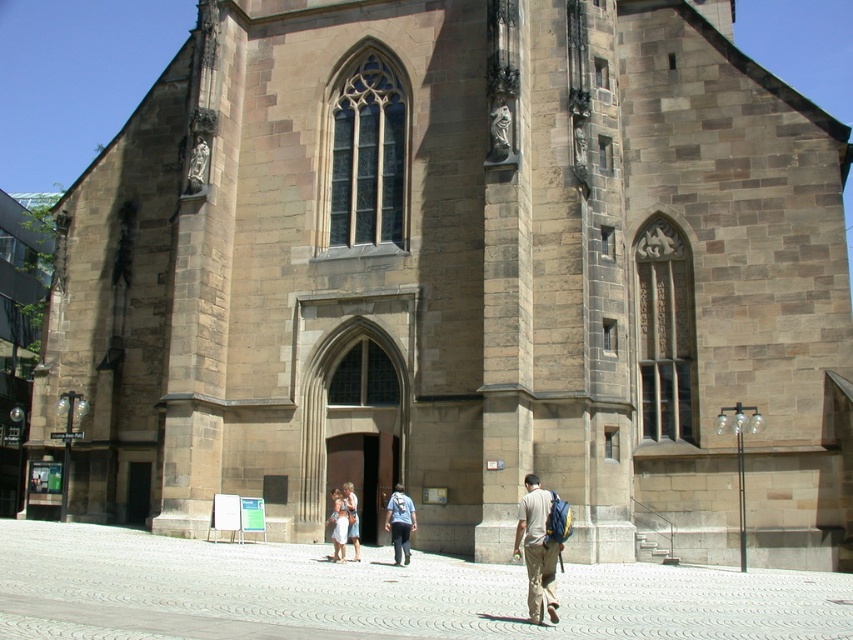
Question: Is light brown canvas backpack at lower right wider than denim backpack at center?

Choices:
 (A) no
 (B) yes

Answer: (B)

Question: Which point is farther from the camera taking this photo?

Choices:
 (A) (355, 499)
 (B) (538, 496)
 (C) (393, 529)
 (D) (341, 550)

Answer: (A)

Question: Does white cotton dress at center have a smaller size compared to light blue denim jeans at center?

Choices:
 (A) no
 (B) yes

Answer: (A)

Question: Estimate the real-world distances between objects in this image. Which object is closer to the white cotton dress at center?

Choices:
 (A) light brown canvas backpack at lower right
 (B) denim backpack at center

Answer: (B)

Question: Can you confirm if light brown canvas backpack at lower right is positioned above white cotton dress at center?

Choices:
 (A) no
 (B) yes

Answer: (B)

Question: Which point is farther from the camera taking this photo?

Choices:
 (A) (547, 509)
 (B) (343, 525)

Answer: (B)